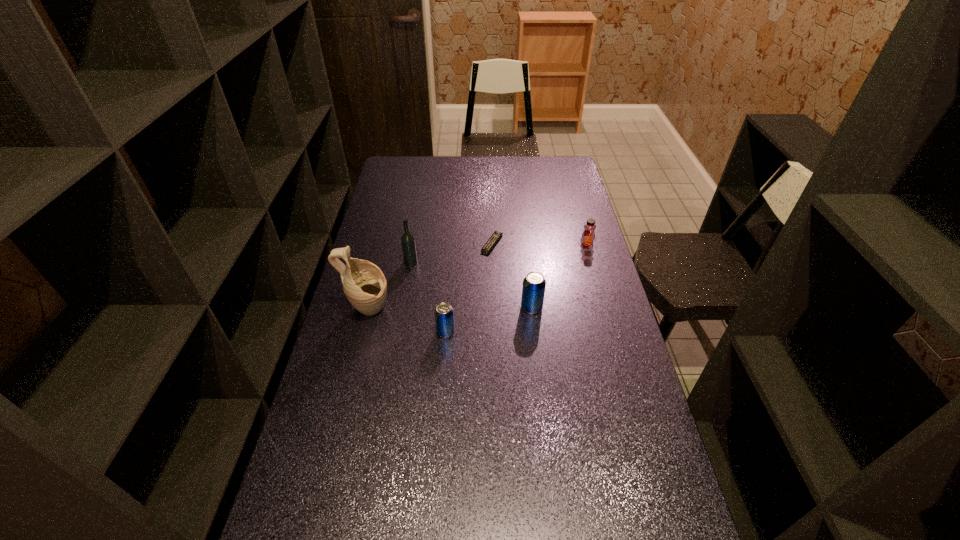
Locate an element on the screen. free space between the fourth object from right to left and the taller beer can is located at coordinates (489, 320).

This screenshot has height=540, width=960. Find the location of `unoccupied position between the fourth object from left to right and the fifth object from right to left`. unoccupied position between the fourth object from left to right and the fifth object from right to left is located at coordinates (451, 253).

Point out which object is positioned as the second nearest to the fourth object from right to left. Please provide its 2D coordinates. Your answer should be formatted as a tuple, i.e. [(x, y)], where the tuple contains the x and y coordinates of a point satisfying the conditions above.

[(533, 290)]

Locate which object is the fourth closest to the third tallest object. Please provide its 2D coordinates. Your answer should be formatted as a tuple, i.e. [(x, y)], where the tuple contains the x and y coordinates of a point satisfying the conditions above.

[(408, 244)]

The width and height of the screenshot is (960, 540). I want to click on vacant space that satisfies the following two spatial constraints: 1. on the front label of the rightmost object; 2. at the spout of the leftmost object, so pos(606,310).

Identify the location of vacant area in the image that satisfies the following two spatial constraints: 1. at the spout of the pitcher; 2. on the back side of the nearer beer can. The image size is (960, 540). (363, 332).

What are the coordinates of `vacant space that satisfies the following two spatial constraints: 1. on the front side of the shortest object; 2. on the right side of the farther beer can` in the screenshot? It's located at (494, 308).